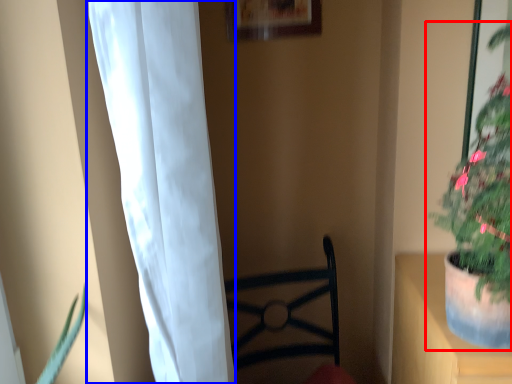
Question: Which of the following is the farthest to the observer, houseplant (highlighted by a red box) or curtain (highlighted by a blue box)?

Choices:
 (A) houseplant
 (B) curtain

Answer: (B)